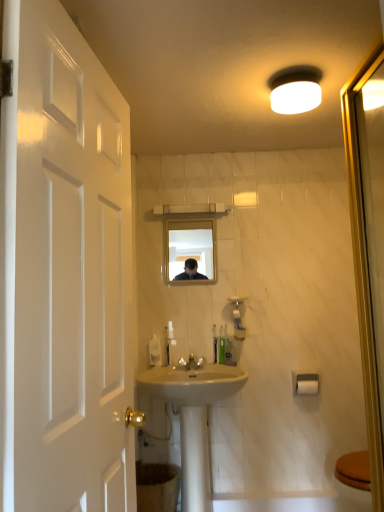
Question: Are clear glass mirror at center and white glossy faucet at center making contact?

Choices:
 (A) yes
 (B) no

Answer: (B)

Question: Considering the relative sizes of clear glass mirror at center and white glossy faucet at center in the image provided, is clear glass mirror at center thinner than white glossy faucet at center?

Choices:
 (A) no
 (B) yes

Answer: (B)

Question: Is clear glass mirror at center taller than white glossy faucet at center?

Choices:
 (A) no
 (B) yes

Answer: (B)

Question: Does clear glass mirror at center have a lesser height compared to white glossy faucet at center?

Choices:
 (A) yes
 (B) no

Answer: (B)

Question: Considering the relative sizes of clear glass mirror at center and white glossy faucet at center in the image provided, is clear glass mirror at center bigger than white glossy faucet at center?

Choices:
 (A) no
 (B) yes

Answer: (B)

Question: Is point (178, 358) closer or farther from the camera than point (220, 331)?

Choices:
 (A) closer
 (B) farther

Answer: (A)

Question: Looking at their shapes, would you say white glossy faucet at center is wider or thinner than translucent plastic soap dispenser at center, placed as the second toiletry when sorted from right to left?

Choices:
 (A) thin
 (B) wide

Answer: (B)

Question: In the image, is white glossy faucet at center positioned in front of or behind translucent plastic soap dispenser at center, placed as the second toiletry when sorted from right to left?

Choices:
 (A) front
 (B) behind

Answer: (A)

Question: In the image, is white glossy faucet at center on the left side or the right side of translucent plastic soap dispenser at center, placed as the second toiletry when sorted from right to left?

Choices:
 (A) right
 (B) left

Answer: (B)

Question: From the image's perspective, is white ceramic sink at center above or below brown textured toilet bowl at lower center?

Choices:
 (A) above
 (B) below

Answer: (A)

Question: Is white ceramic sink at center wider or thinner than brown textured toilet bowl at lower center?

Choices:
 (A) wide
 (B) thin

Answer: (A)

Question: Considering the positions of point (192, 453) and point (165, 497), is point (192, 453) closer or farther from the camera than point (165, 497)?

Choices:
 (A) closer
 (B) farther

Answer: (B)

Question: From a real-world perspective, is white ceramic sink at center positioned above or below brown textured toilet bowl at lower center?

Choices:
 (A) below
 (B) above

Answer: (B)

Question: Is brown textured toilet bowl at lower center inside or outside of white plastic soap dispenser at center?

Choices:
 (A) inside
 (B) outside

Answer: (B)

Question: From their relative heights in the image, would you say brown textured toilet bowl at lower center is taller or shorter than white plastic soap dispenser at center?

Choices:
 (A) tall
 (B) short

Answer: (A)